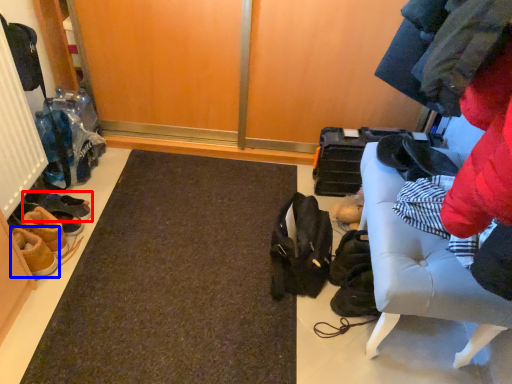
Question: Which object appears closest to the camera in this image, footwear (highlighted by a red box) or footwear (highlighted by a blue box)?

Choices:
 (A) footwear
 (B) footwear

Answer: (B)